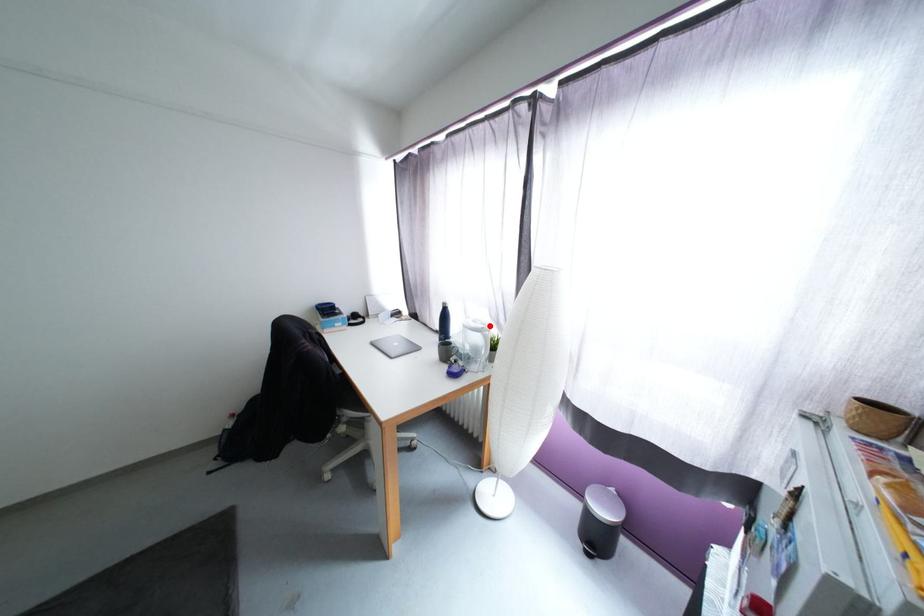
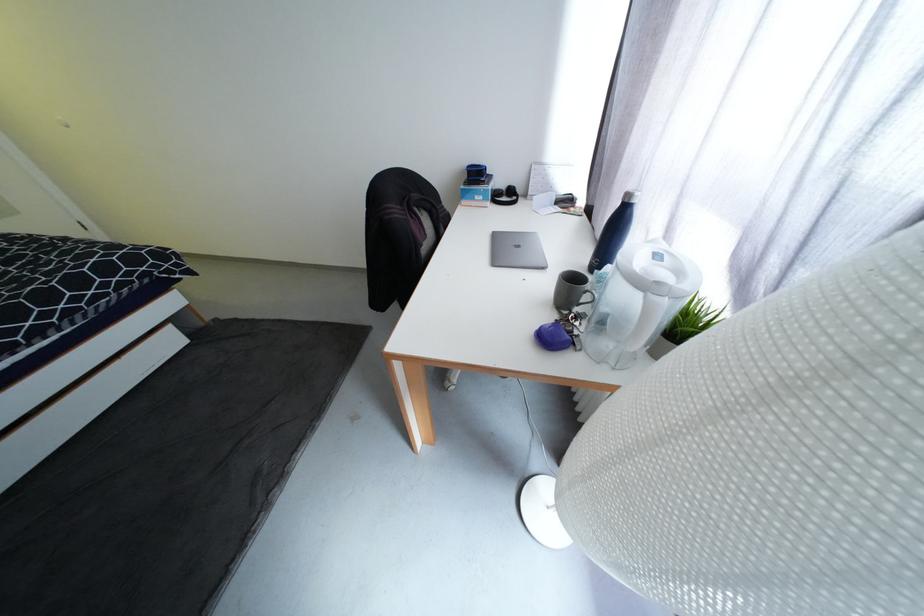
Locate, in the second image, the point that corresponds to the highlighted location in the first image.

(686, 274)